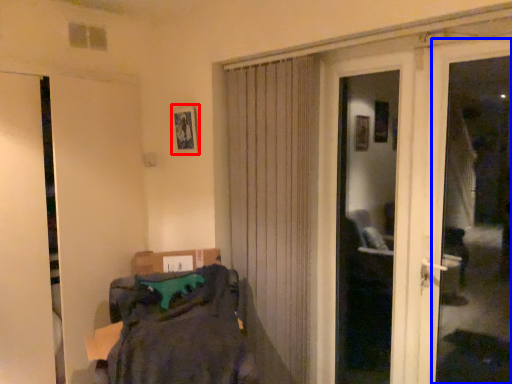
Question: Which object appears farthest to the camera in this image, picture frame (highlighted by a red box) or window frame (highlighted by a blue box)?

Choices:
 (A) picture frame
 (B) window frame

Answer: (A)